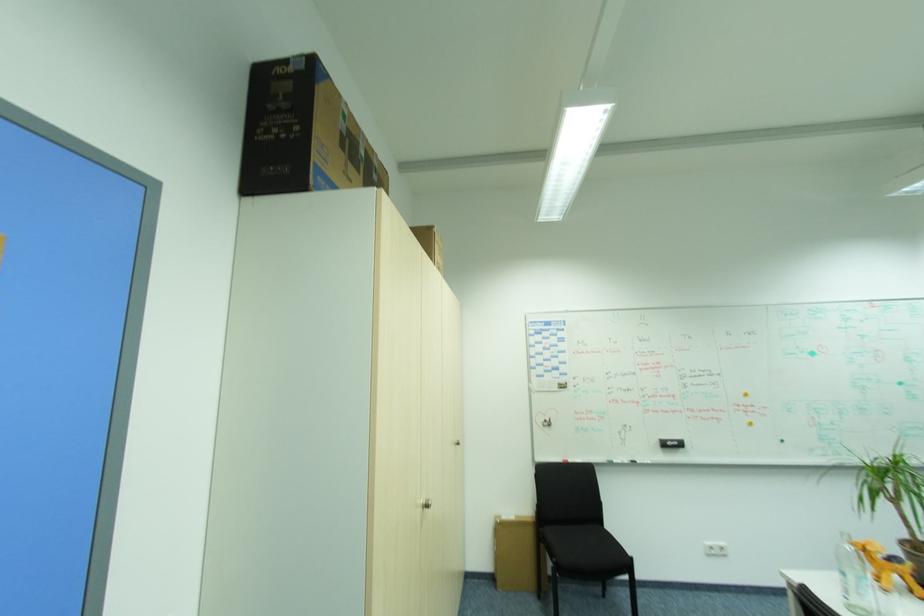
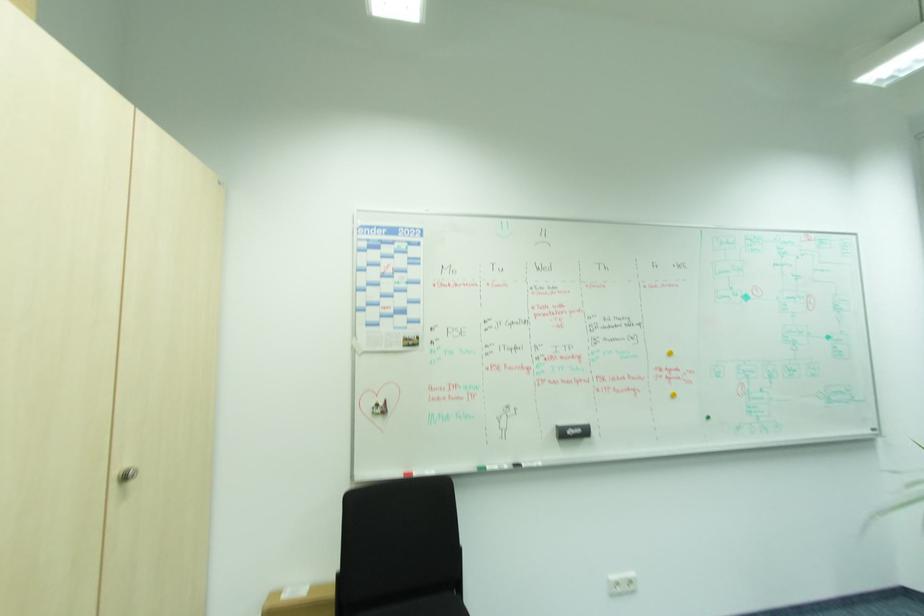
Find the pixel in the second image that matches pixel 643 462 in the first image.

(528, 464)